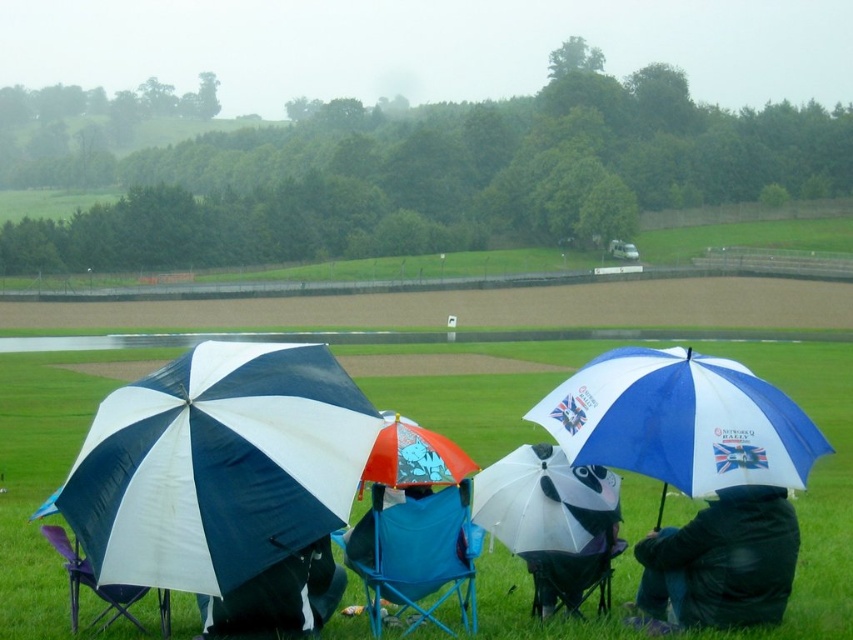
Can you confirm if dark blue jacket at lower right is shorter than white matte umbrella at center?

In fact, dark blue jacket at lower right may be taller than white matte umbrella at center.

Which is behind, point (758, 522) or point (535, 486)?

The point (535, 486) is behind.

Who is more forward, (757,554) or (552,518)?

Point (757,554)

Where is `dark blue jacket at lower right`? dark blue jacket at lower right is located at coordinates (721, 563).

Can you confirm if white matte umbrella at center is positioned to the right of blue fabric chair at lower center?

Incorrect, white matte umbrella at center is not on the right side of blue fabric chair at lower center.

Looking at this image, is white matte umbrella at center to the left of blue fabric chair at lower center from the viewer's perspective?

Indeed, white matte umbrella at center is positioned on the left side of blue fabric chair at lower center.

Who is more distant from viewer, (552, 540) or (573, 596)?

The point (573, 596) is more distant.

Where is `white matte umbrella at center`? This screenshot has width=853, height=640. white matte umbrella at center is located at coordinates (543, 500).

In the scene shown: Can you confirm if green grass at center is taller than blue and white fabric umbrella at center right?

Correct, green grass at center is much taller as blue and white fabric umbrella at center right.

Can you confirm if green grass at center is positioned to the left of blue and white fabric umbrella at center right?

Correct, you'll find green grass at center to the left of blue and white fabric umbrella at center right.

Where is `green grass at center`? The width and height of the screenshot is (853, 640). green grass at center is located at coordinates (39, 477).

The height and width of the screenshot is (640, 853). What are the coordinates of `green grass at center` in the screenshot? It's located at (39, 477).